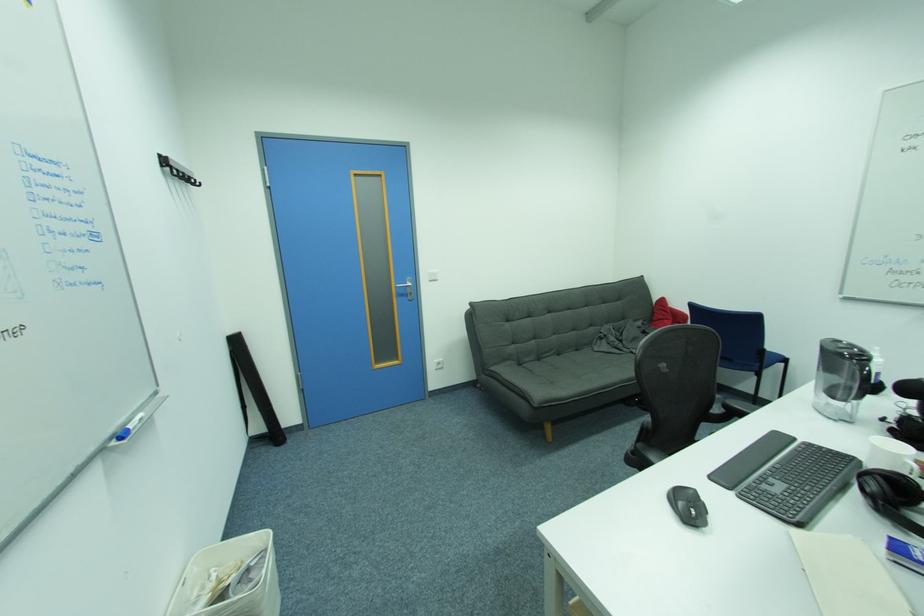
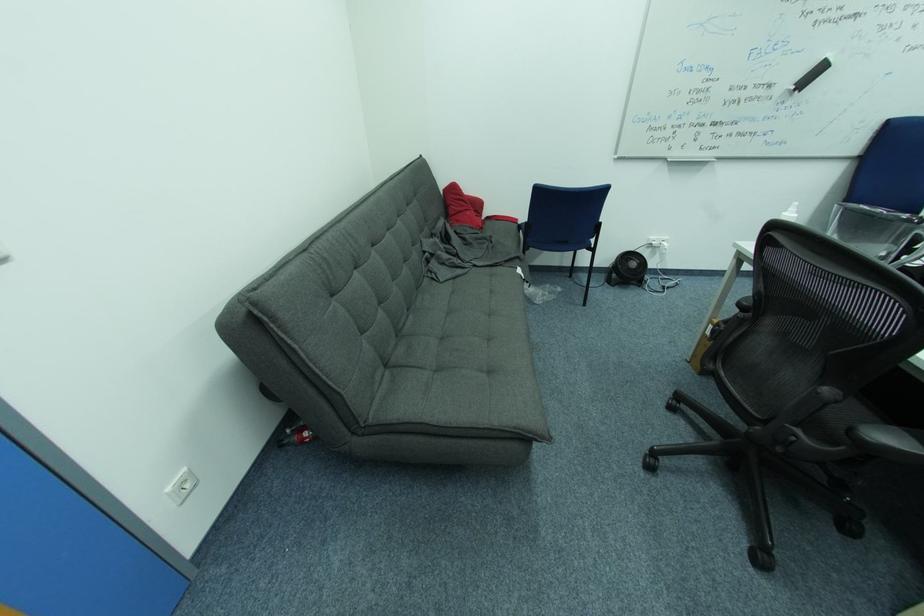
Where in the second image is the point corresponding to the point at 669,302 from the first image?

(459, 188)